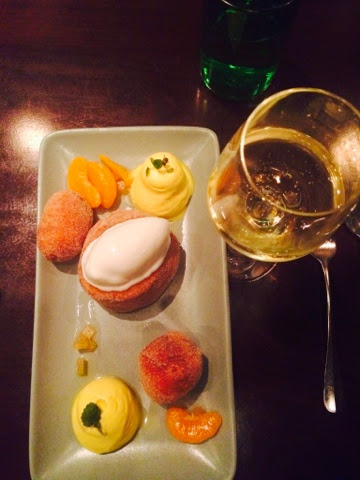
Where is `glass`? This screenshot has height=480, width=360. glass is located at coordinates (313, 240).